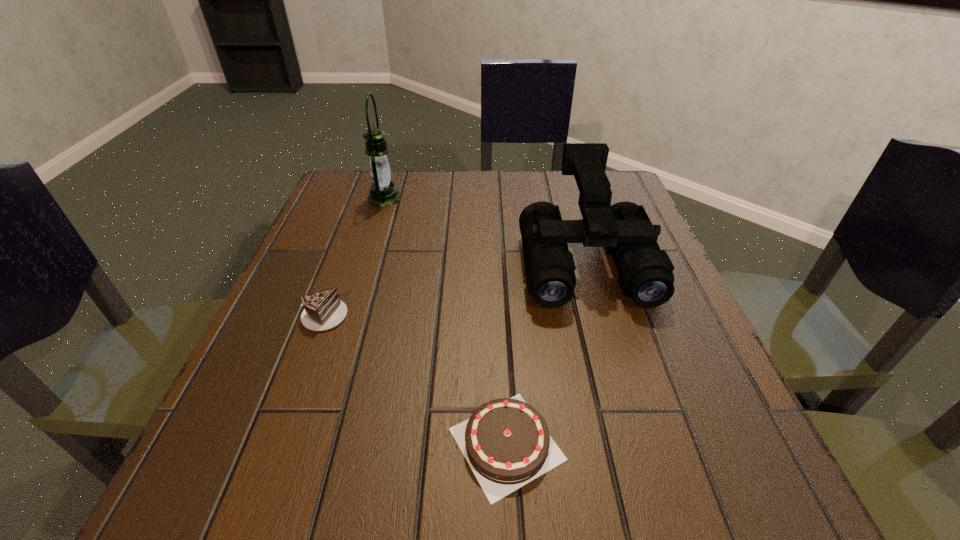
At what (x,y) coordinates should I click in order to perform the action: click on vacant space located on the back of the shortest object. Please return your answer as a coordinate pair (x, y). This screenshot has width=960, height=540. Looking at the image, I should click on (496, 235).

Find the location of `lantern positioned at the far edge`. lantern positioned at the far edge is located at coordinates (383, 193).

I want to click on binoculars that is at the far edge, so click(645, 271).

This screenshot has width=960, height=540. Find the location of `object present at the near edge`. object present at the near edge is located at coordinates (506, 442).

I want to click on lantern located at the left edge, so click(x=383, y=193).

Locate an element on the screen. This screenshot has height=540, width=960. chocolate cake present at the left edge is located at coordinates click(x=324, y=310).

I want to click on object that is at the right edge, so click(x=645, y=271).

What are the coordinates of `object at the far left corner` in the screenshot? It's located at [x=383, y=193].

I want to click on object that is at the far right corner, so click(x=645, y=271).

This screenshot has width=960, height=540. Find the location of `free point at the far edge`. free point at the far edge is located at coordinates click(x=432, y=221).